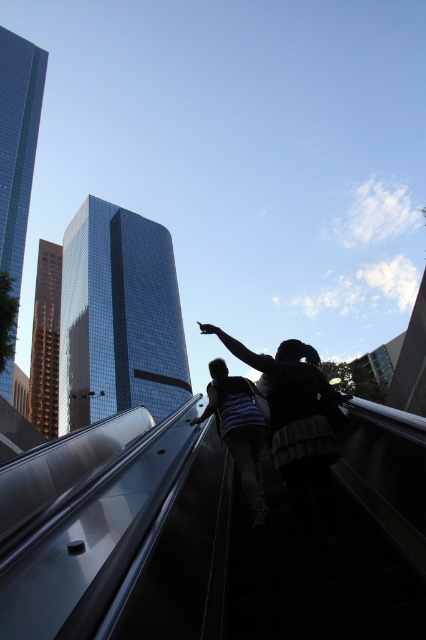
Question: Is silhouette casual clothing at center smaller than dark blue jeans at center?

Choices:
 (A) yes
 (B) no

Answer: (B)

Question: Which object appears farthest from the camera in this image?

Choices:
 (A) dark blue jeans at center
 (B) silhouette casual clothing at center

Answer: (A)

Question: Is silhouette casual clothing at center positioned in front of dark blue jeans at center?

Choices:
 (A) no
 (B) yes

Answer: (B)

Question: Among these objects, which one is farthest from the camera?

Choices:
 (A) dark blue jeans at center
 (B) silhouette casual clothing at center

Answer: (A)

Question: Is silhouette casual clothing at center to the right of dark blue jeans at center from the viewer's perspective?

Choices:
 (A) no
 (B) yes

Answer: (B)